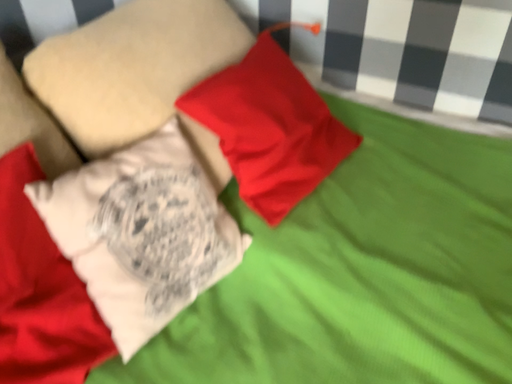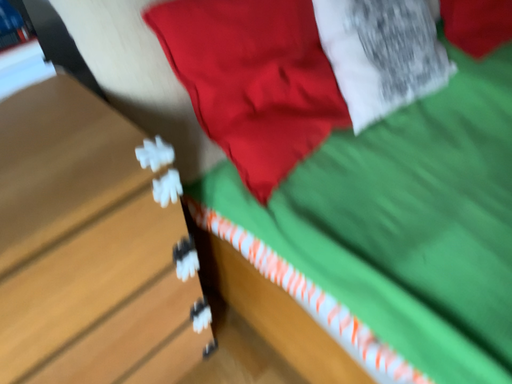
Question: How did the camera likely rotate when shooting the video?

Choices:
 (A) rotated downward
 (B) rotated upward

Answer: (A)